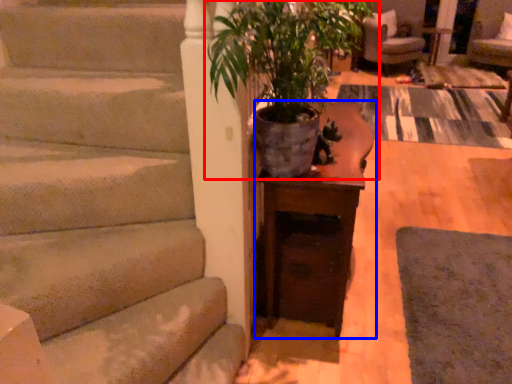
Question: Which object appears closest to the camera in this image, houseplant (highlighted by a red box) or table (highlighted by a blue box)?

Choices:
 (A) houseplant
 (B) table

Answer: (A)